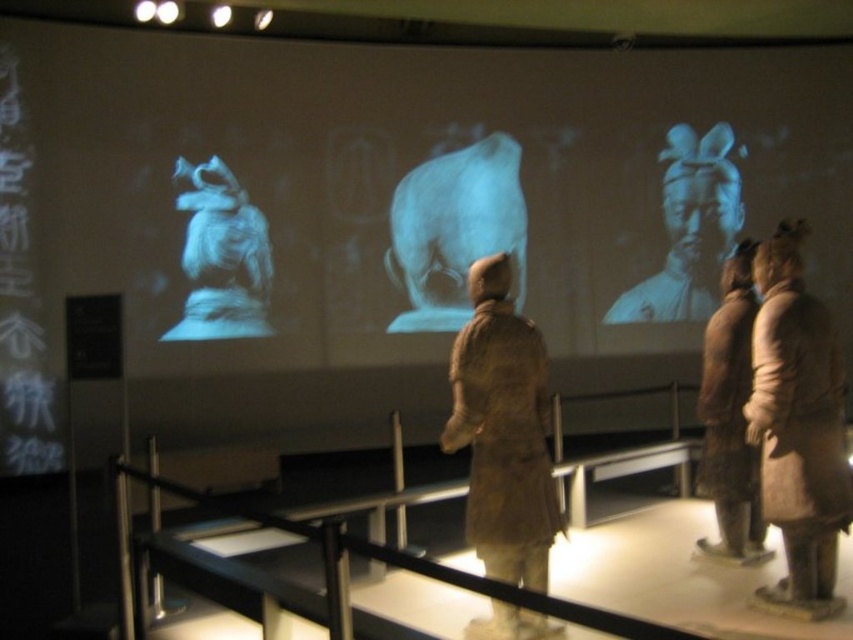
Question: From the image, what is the correct spatial relationship of matte gray statue at upper right in relation to brown matte statue at right?

Choices:
 (A) right
 (B) left

Answer: (A)

Question: Among these objects, which one is farthest from the camera?

Choices:
 (A) matte gray statue at upper right
 (B) earthenware figure at center
 (C) matte gray statue at upper center
 (D) brown matte statue at right

Answer: (A)

Question: Can you confirm if matte gray statue at upper right is wider than matte gray statue at upper left?

Choices:
 (A) no
 (B) yes

Answer: (B)

Question: Can you confirm if matte gray statue at center is positioned to the left of matte gray statue at upper right?

Choices:
 (A) yes
 (B) no

Answer: (A)

Question: Considering the real-world distances, which object is farthest from the matte gray statue at upper left?

Choices:
 (A) brown matte statue at right
 (B) brown wool coat at right

Answer: (B)

Question: Estimate the real-world distances between objects in this image. Which object is closer to the brown matte statue at right?

Choices:
 (A) matte gray statue at upper right
 (B) matte gray statue at upper left
 (C) matte gray statue at upper center
 (D) brown wool coat at right

Answer: (D)